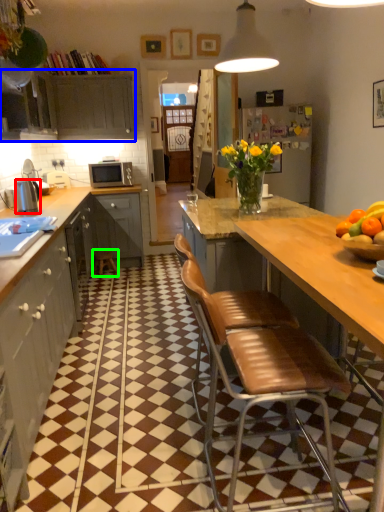
Question: Estimate the real-world distances between objects in this image. Which object is farther from kitchen appliance (highlighted by a red box), cabinetry (highlighted by a blue box) or bar stool (highlighted by a green box)?

Choices:
 (A) cabinetry
 (B) bar stool

Answer: (A)